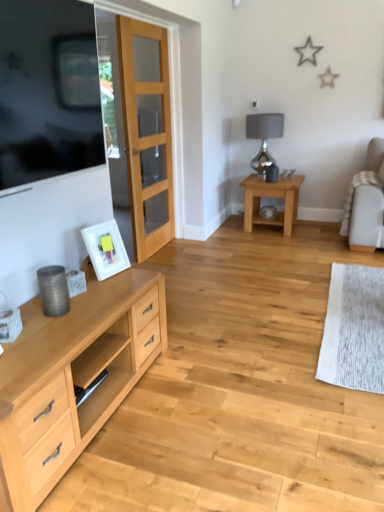
This screenshot has height=512, width=384. Find the location of `free space to the right of clear glass door at center`. free space to the right of clear glass door at center is located at coordinates (205, 251).